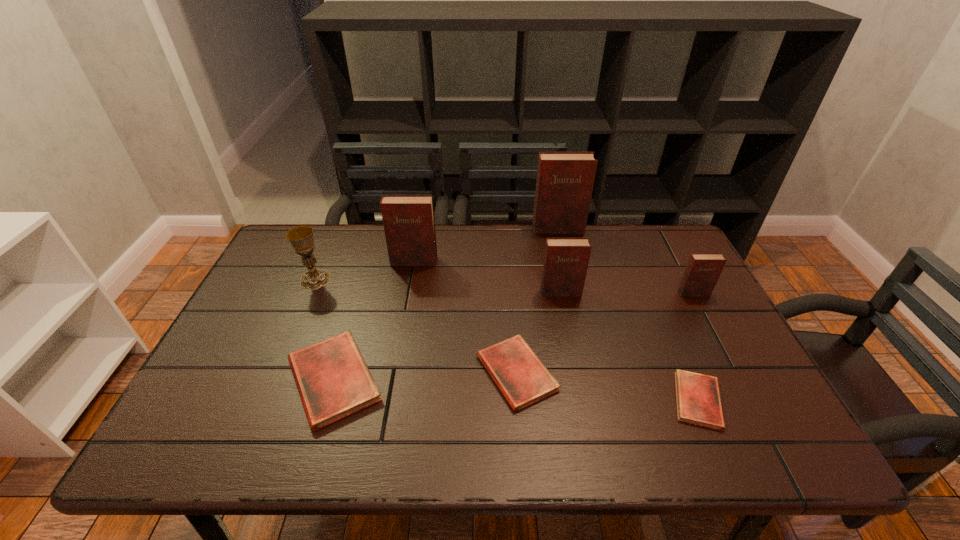
Identify the location of vacant space located on the back of the second biggest red diary. (512, 301).

The image size is (960, 540). Find the location of `blank area located on the left of the shortest object`. blank area located on the left of the shortest object is located at coordinates (547, 400).

Find the location of `object at the left edge`. object at the left edge is located at coordinates pos(301,237).

The image size is (960, 540). I want to click on object that is at the near right corner, so click(698, 398).

Image resolution: width=960 pixels, height=540 pixels. I want to click on blank space at the far edge of the desktop, so click(480, 249).

This screenshot has height=540, width=960. In order to click on vacant space at the near edge of the desktop in this screenshot , I will do `click(547, 423)`.

Locate an element on the screen. Image resolution: width=960 pixels, height=540 pixels. free space at the left edge is located at coordinates (263, 320).

You are a GUI agent. You are given a task and a screenshot of the screen. Output one action in this format:
    pyautogui.click(x=<x>, y=<y>)
    Task: Click on the free space at the right edge of the desktop
    This screenshot has width=960, height=540.
    Given the screenshot: What is the action you would take?
    pyautogui.click(x=653, y=285)

In order to click on vacant position at the far right corner of the desktop in this screenshot , I will do `click(631, 224)`.

Locate an element on the screen. The width and height of the screenshot is (960, 540). empty location between the biggest red diary and the second farthest object is located at coordinates (373, 321).